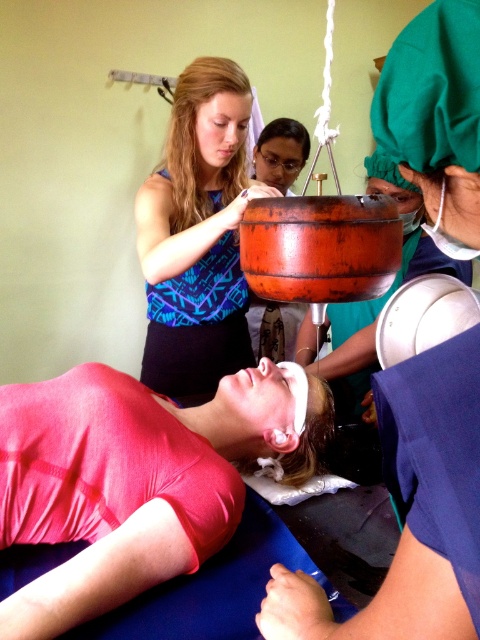
You are a medical student observing a procedure. The patient is lying on a blue surface with their head covered. The central figure is a woman with long blonde hair. Where is the matte orange basin at center located in relation to the patient?

The matte orange basin at center is located at point (x=410, y=516).

You are a medical student observing a procedure. You notice the matte orange basin at center and the blue patterned tank top at upper center. Which object takes up more area in the image?

The blue patterned tank top at upper center takes up more area than the matte orange basin at center.

What color is the fabric located at the lower left of the point at coordinates (137, 477)?

The fabric at the lower left of the point at coordinates (137, 477) is pink.